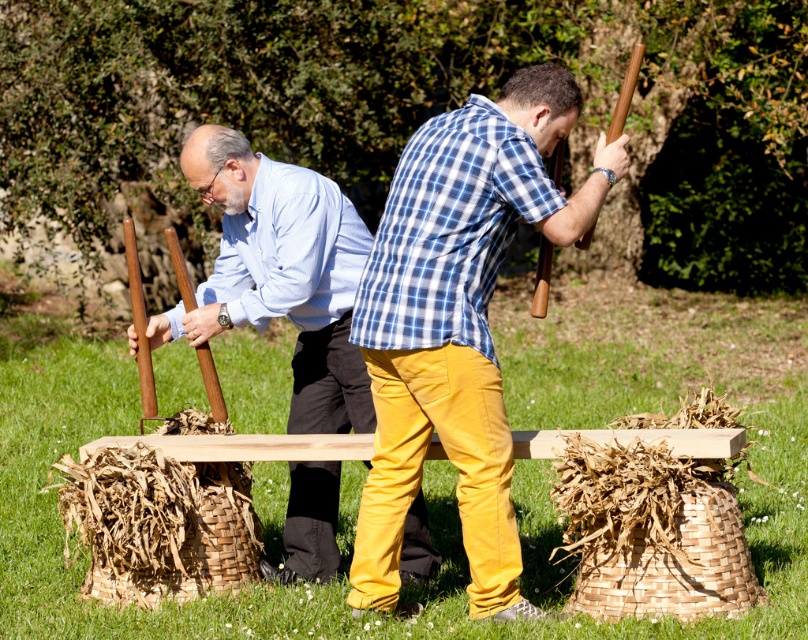
Question: Observing the image, what is the correct spatial positioning of matte brown wooden stick at center in reference to matte brown wooden stick at left?

Choices:
 (A) left
 (B) right

Answer: (B)

Question: Is matte brown wooden stick at center to the right of matte brown wooden stick at left from the viewer's perspective?

Choices:
 (A) no
 (B) yes

Answer: (B)

Question: Which of the following is the closest to the observer?

Choices:
 (A) (318, 268)
 (B) (358, 548)

Answer: (B)

Question: Is matte brown wooden stick at center below matte brown wooden stick at left?

Choices:
 (A) yes
 (B) no

Answer: (B)

Question: Which point is farther to the camera?

Choices:
 (A) matte brown wooden stick at left
 (B) matte brown wooden stick at center

Answer: (A)